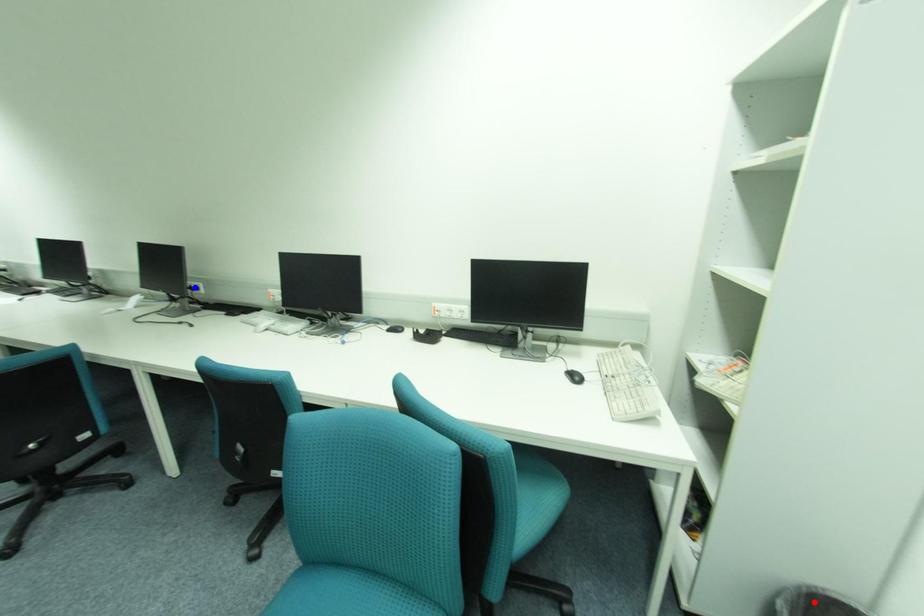
Question: Which of the two points in the image is closer to the camera?

Choices:
 (A) Blue point is closer.
 (B) Red point is closer.

Answer: (B)